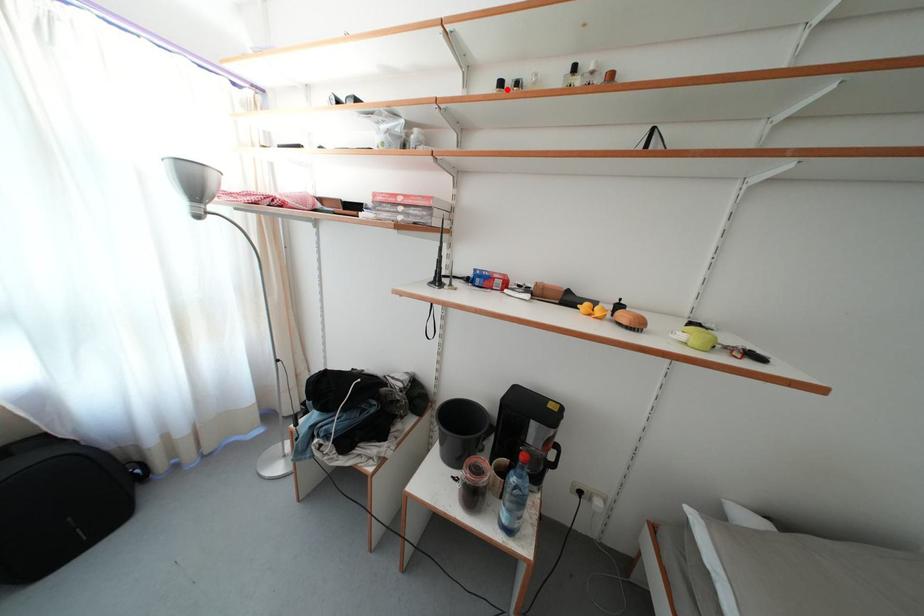
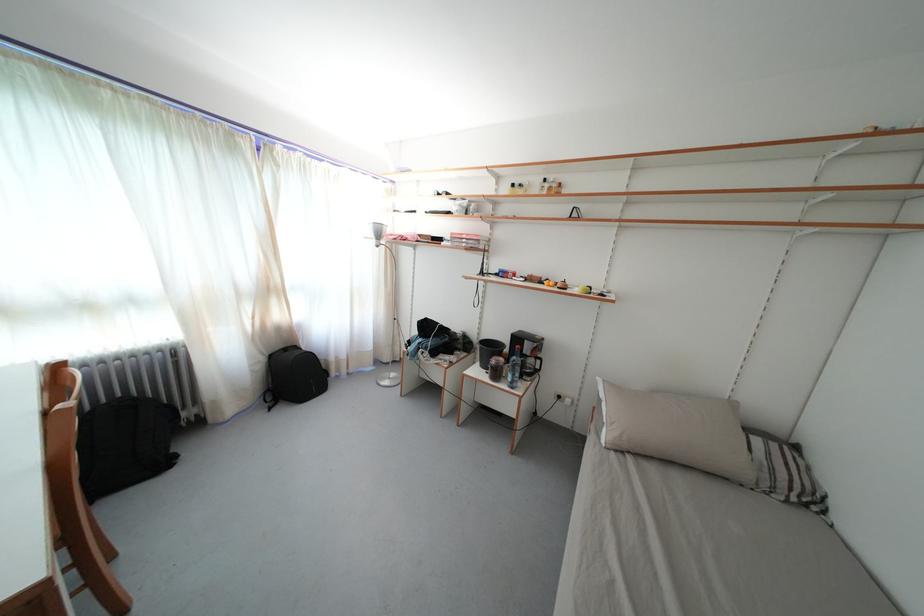
Find the pixel in the second image that matches the highlighted location in the first image.

(518, 191)